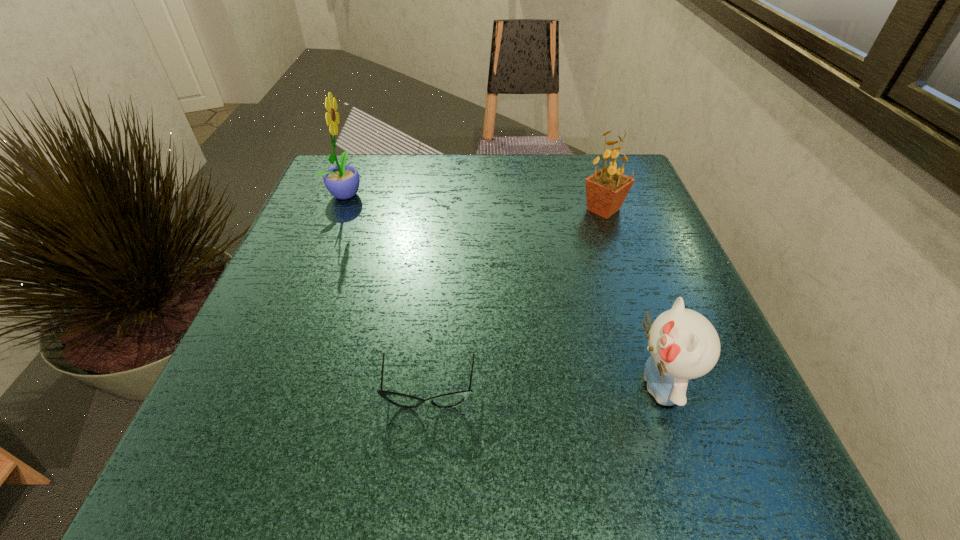
Locate an element on the screen. Image resolution: width=960 pixels, height=540 pixels. free point that satisfies the following two spatial constraints: 1. on the front-facing side of the kitten; 2. on the front-facing side of the spectacles is located at coordinates (660, 391).

What are the coordinates of `free space in the image that satisfies the following two spatial constraints: 1. at the front of the right sunflower with flowers visible; 2. on the front-facing side of the shortest object` in the screenshot? It's located at (665, 391).